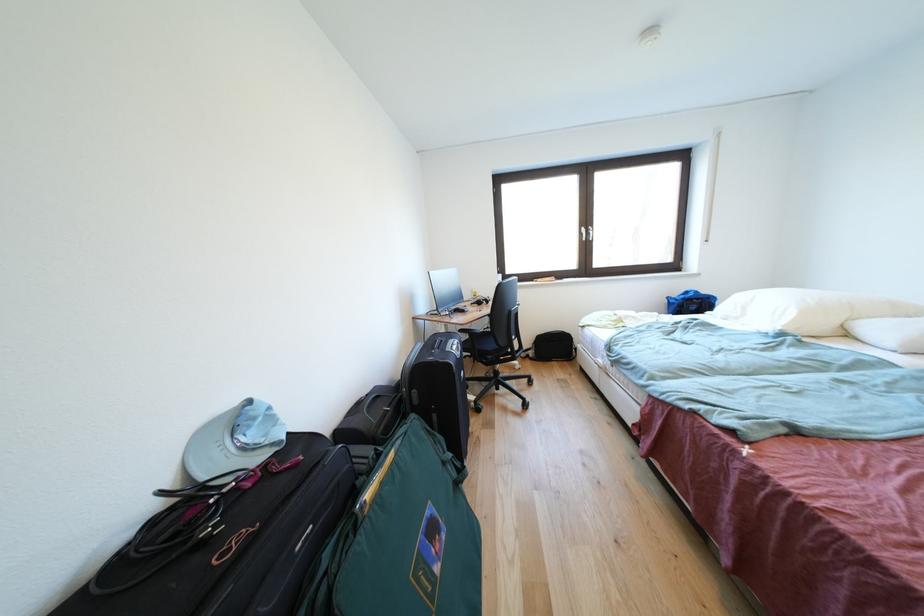
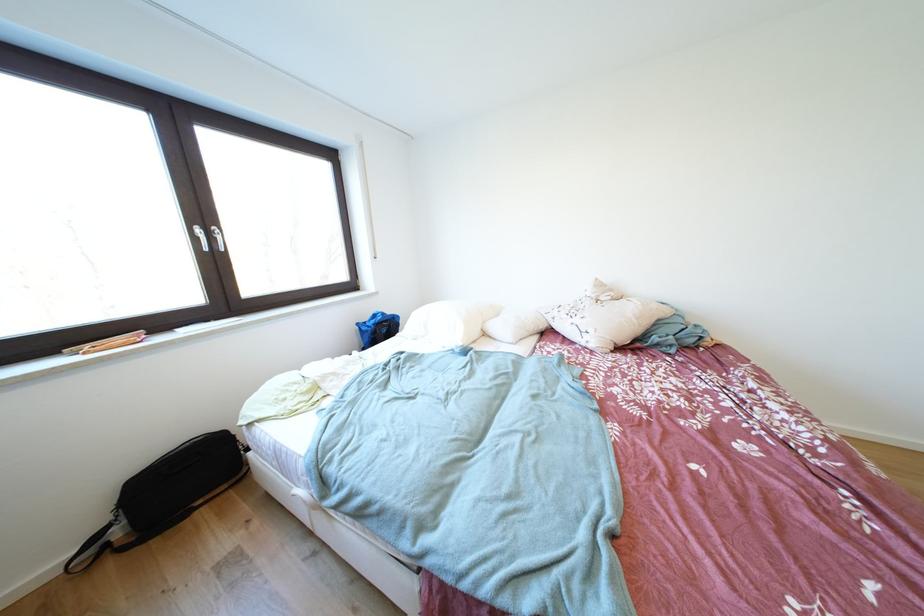
Where in the second image is the point corresponding to the point at 538,351 from the first image?

(114, 524)